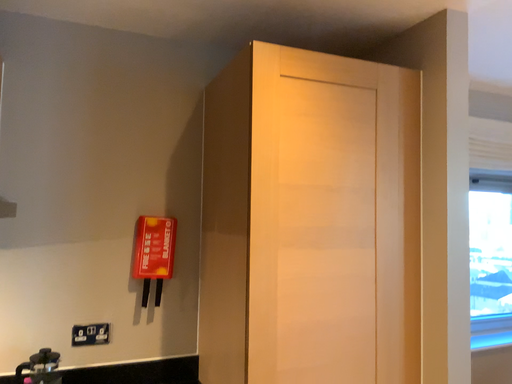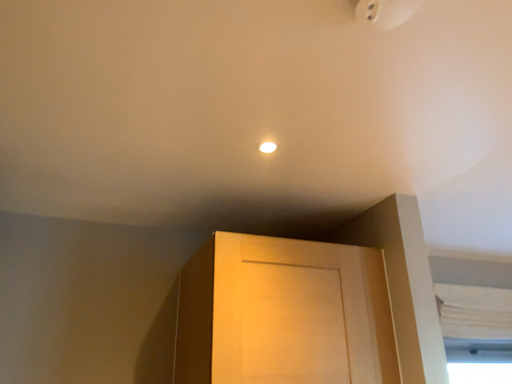
Question: Which way did the camera rotate in the video?

Choices:
 (A) rotated upward
 (B) rotated downward

Answer: (A)